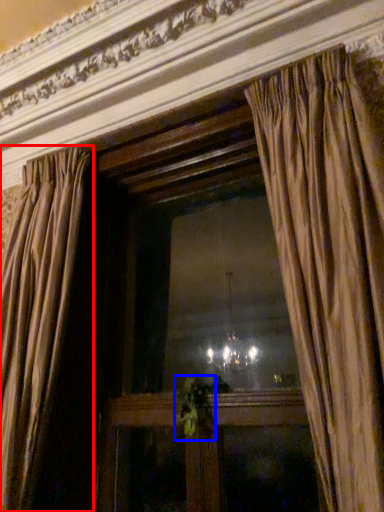
Question: Which of the following is the closest to the observer, curtain (highlighted by a red box) or plant (highlighted by a blue box)?

Choices:
 (A) curtain
 (B) plant

Answer: (A)